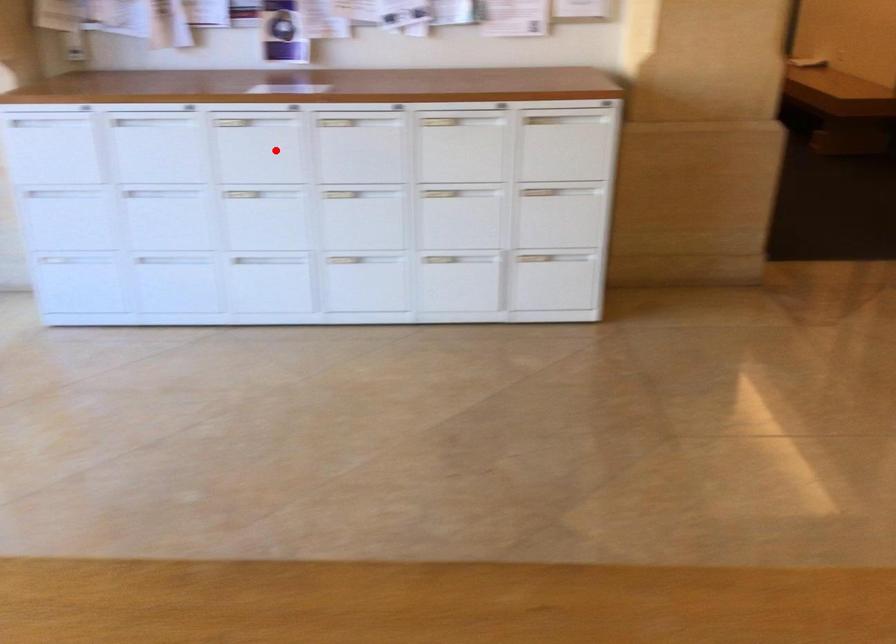
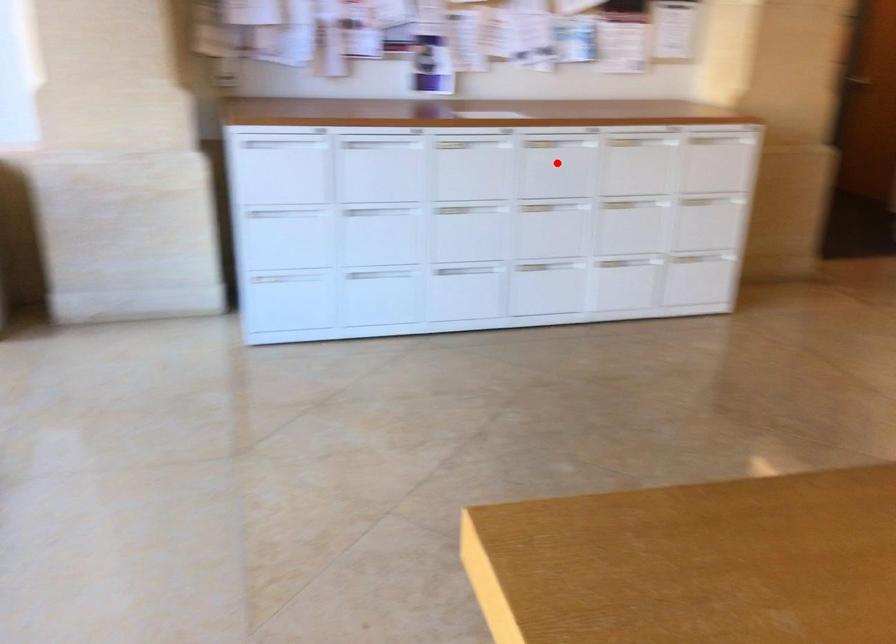
I am providing you with two images of the same scene from different viewpoints. A red point is marked on the first image and another point is marked on the second image. Do the highlighted points in image1 and image2 indicate the same real-world spot?

No